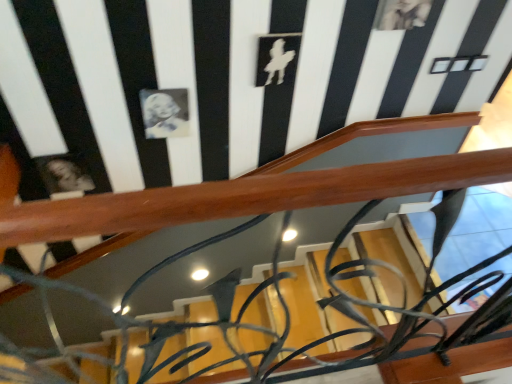
Identify the location of black glossy portrait at upper center, which is the 2th art in bottom-to-top order. The image size is (512, 384). (165, 113).

Describe the element at coordinates (165, 113) in the screenshot. The height and width of the screenshot is (384, 512). I see `black glossy portrait at upper center, which is the 2th art in bottom-to-top order` at that location.

Describe the element at coordinates (68, 176) in the screenshot. This screenshot has width=512, height=384. I see `matte black portrait at upper left, which is the second art from right to left` at that location.

You are a GUI agent. You are given a task and a screenshot of the screen. Output one action in this format:
    pyautogui.click(x=<x>, y=<y>)
    Task: Click on the matte black portrait at upper left, the second art positioned from the top
    Image resolution: width=512 pixels, height=384 pixels.
    Given the screenshot: What is the action you would take?
    pyautogui.click(x=68, y=176)

Locate an element on the screen. This screenshot has height=384, width=512. black glossy portrait at upper center, the first art in the right-to-left sequence is located at coordinates (165, 113).

Looking at this image, between matte black portrait at upper left, which is the first art from left to right, and black glossy portrait at upper center, the 1th art from the top, which one appears on the left side from the viewer's perspective?

From the viewer's perspective, matte black portrait at upper left, which is the first art from left to right, appears more on the left side.

Based on the photo, is matte black portrait at upper left, which is the second art from right to left, further to camera compared to black glossy portrait at upper center, which is the 2th art in bottom-to-top order?

Yes, it is behind black glossy portrait at upper center, which is the 2th art in bottom-to-top order.

Does point (71, 185) lie in front of point (156, 119)?

No, it is not.

From the image's perspective, is matte black portrait at upper left, which is the first art from left to right, above or below black glossy portrait at upper center, which is the 2th art in bottom-to-top order?

matte black portrait at upper left, which is the first art from left to right, is below black glossy portrait at upper center, which is the 2th art in bottom-to-top order.

From a real-world perspective, is matte black portrait at upper left, the second art positioned from the top, above or below black glossy portrait at upper center, which is counted as the second art, starting from the left?

matte black portrait at upper left, the second art positioned from the top, is situated lower than black glossy portrait at upper center, which is counted as the second art, starting from the left, in the real world.

Is matte black portrait at upper left, the 1th art when ordered from bottom to top, wider or thinner than black glossy portrait at upper center, the 1th art from the top?

In the image, matte black portrait at upper left, the 1th art when ordered from bottom to top, appears to be more narrow than black glossy portrait at upper center, the 1th art from the top.

Looking at this image, in terms of height, does matte black portrait at upper left, which is the first art from left to right, look taller or shorter compared to black glossy portrait at upper center, the first art in the right-to-left sequence?

matte black portrait at upper left, which is the first art from left to right, is shorter than black glossy portrait at upper center, the first art in the right-to-left sequence.

Between matte black portrait at upper left, the 1th art when ordered from bottom to top, and black glossy portrait at upper center, which is counted as the second art, starting from the left, which one has larger size?

matte black portrait at upper left, the 1th art when ordered from bottom to top.

Would you say matte black portrait at upper left, which is the first art from left to right, contains black glossy portrait at upper center, which is counted as the second art, starting from the left?

No, black glossy portrait at upper center, which is counted as the second art, starting from the left, is not inside matte black portrait at upper left, which is the first art from left to right.

Would you say matte black portrait at upper left, the 1th art when ordered from bottom to top, is a long distance from black glossy portrait at upper center, which is the 2th art in bottom-to-top order?

Actually, matte black portrait at upper left, the 1th art when ordered from bottom to top, and black glossy portrait at upper center, which is the 2th art in bottom-to-top order, are a little close together.

Is matte black portrait at upper left, the 1th art when ordered from bottom to top, looking in the opposite direction of black glossy portrait at upper center, the 1th art from the top?

matte black portrait at upper left, the 1th art when ordered from bottom to top, does not have its back to black glossy portrait at upper center, the 1th art from the top.

How different are the orientations of matte black portrait at upper left, which is the second art from right to left, and black glossy portrait at upper center, which is the 2th art in bottom-to-top order, in degrees?

matte black portrait at upper left, which is the second art from right to left, and black glossy portrait at upper center, which is the 2th art in bottom-to-top order, are facing 0.00291 degrees away from each other.

How much distance is there between matte black portrait at upper left, the 1th art when ordered from bottom to top, and black glossy portrait at upper center, the 1th art from the top?

They are 19.73 inches apart.

At what (x,y) coordinates should I click in order to perform the action: click on art in front of the matte black portrait at upper left, which is the first art from left to right. Please return your answer as a coordinate pair (x, y). Image resolution: width=512 pixels, height=384 pixels. Looking at the image, I should click on (165, 113).

Can you confirm if black glossy portrait at upper center, the first art in the right-to-left sequence, is positioned to the left of matte black portrait at upper left, the 1th art when ordered from bottom to top?

No.

Is the position of black glossy portrait at upper center, which is counted as the second art, starting from the left, less distant than that of matte black portrait at upper left, which is the first art from left to right?

Yes, it is in front of matte black portrait at upper left, which is the first art from left to right.

Which is closer, (167, 136) or (69, 162)?

Point (167, 136) is positioned closer to the camera compared to point (69, 162).

From the image's perspective, is black glossy portrait at upper center, the first art in the right-to-left sequence, positioned above or below matte black portrait at upper left, which is the first art from left to right?

Clearly, from the image's perspective, black glossy portrait at upper center, the first art in the right-to-left sequence, is above matte black portrait at upper left, which is the first art from left to right.

In the scene shown: From a real-world perspective, is black glossy portrait at upper center, the first art in the right-to-left sequence, positioned above or below matte black portrait at upper left, which is the second art from right to left?

In terms of real-world spatial position, black glossy portrait at upper center, the first art in the right-to-left sequence, is above matte black portrait at upper left, which is the second art from right to left.

Considering the relative sizes of black glossy portrait at upper center, which is the 2th art in bottom-to-top order, and matte black portrait at upper left, the second art positioned from the top, in the image provided, is black glossy portrait at upper center, which is the 2th art in bottom-to-top order, thinner than matte black portrait at upper left, the second art positioned from the top,?

Incorrect, the width of black glossy portrait at upper center, which is the 2th art in bottom-to-top order, is not less than that of matte black portrait at upper left, the second art positioned from the top.

Is black glossy portrait at upper center, the 1th art from the top, taller or shorter than matte black portrait at upper left, which is the second art from right to left?

Clearly, black glossy portrait at upper center, the 1th art from the top, is taller compared to matte black portrait at upper left, which is the second art from right to left.

Considering the sizes of objects black glossy portrait at upper center, the first art in the right-to-left sequence, and matte black portrait at upper left, the 1th art when ordered from bottom to top, in the image provided, who is smaller, black glossy portrait at upper center, the first art in the right-to-left sequence, or matte black portrait at upper left, the 1th art when ordered from bottom to top,?

black glossy portrait at upper center, the first art in the right-to-left sequence, is smaller.

Is black glossy portrait at upper center, the 1th art from the top, completely or partially outside of matte black portrait at upper left, the second art positioned from the top?

Yes, black glossy portrait at upper center, the 1th art from the top, is located beyond the bounds of matte black portrait at upper left, the second art positioned from the top.

Is there a large distance between black glossy portrait at upper center, the 1th art from the top, and matte black portrait at upper left, the second art positioned from the top?

black glossy portrait at upper center, the 1th art from the top, is actually quite close to matte black portrait at upper left, the second art positioned from the top.

Is black glossy portrait at upper center, which is the 2th art in bottom-to-top order, aimed at matte black portrait at upper left, which is the second art from right to left?

No, black glossy portrait at upper center, which is the 2th art in bottom-to-top order, is not aimed at matte black portrait at upper left, which is the second art from right to left.

How different are the orientations of black glossy portrait at upper center, the 1th art from the top, and matte black portrait at upper left, which is the second art from right to left, in degrees?

black glossy portrait at upper center, the 1th art from the top, and matte black portrait at upper left, which is the second art from right to left, are facing 0.00291 degrees away from each other.

Locate an element on the screen. art behind the black glossy portrait at upper center, the first art in the right-to-left sequence is located at coordinates (68, 176).

The width and height of the screenshot is (512, 384). Identify the location of art above the matte black portrait at upper left, the 1th art when ordered from bottom to top (from a real-world perspective). (165, 113).

Locate an element on the screen. art below the black glossy portrait at upper center, the 1th art from the top (from a real-world perspective) is located at coordinates (68, 176).